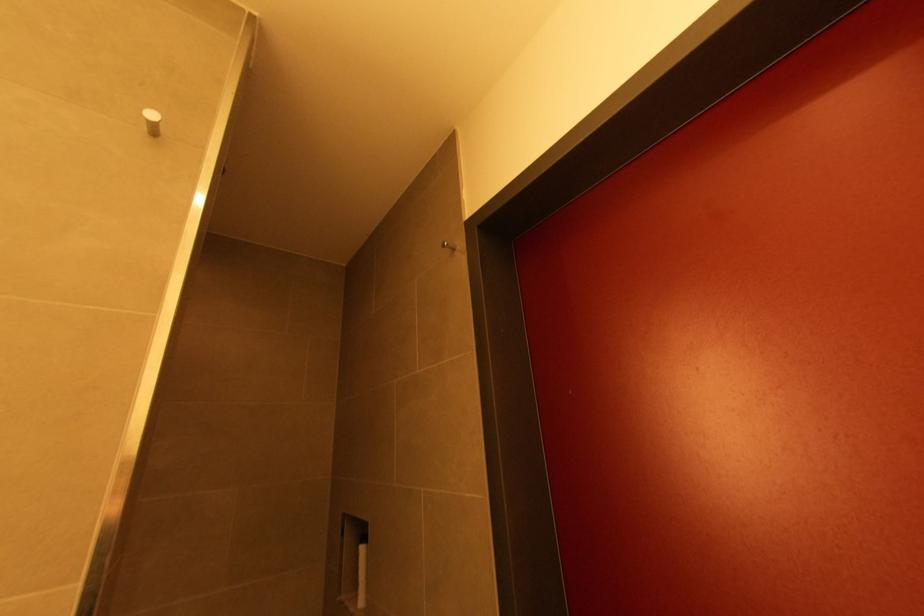
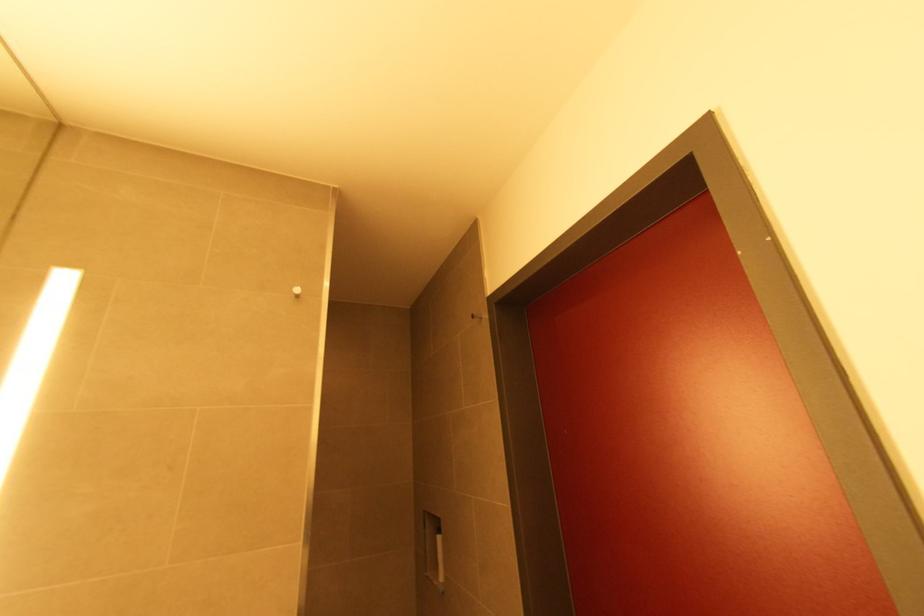
Question: The first image is from the beginning of the video and the second image is from the end. How did the camera likely rotate when shooting the video?

Choices:
 (A) Left
 (B) Right
 (C) Up
 (D) Down

Answer: (A)